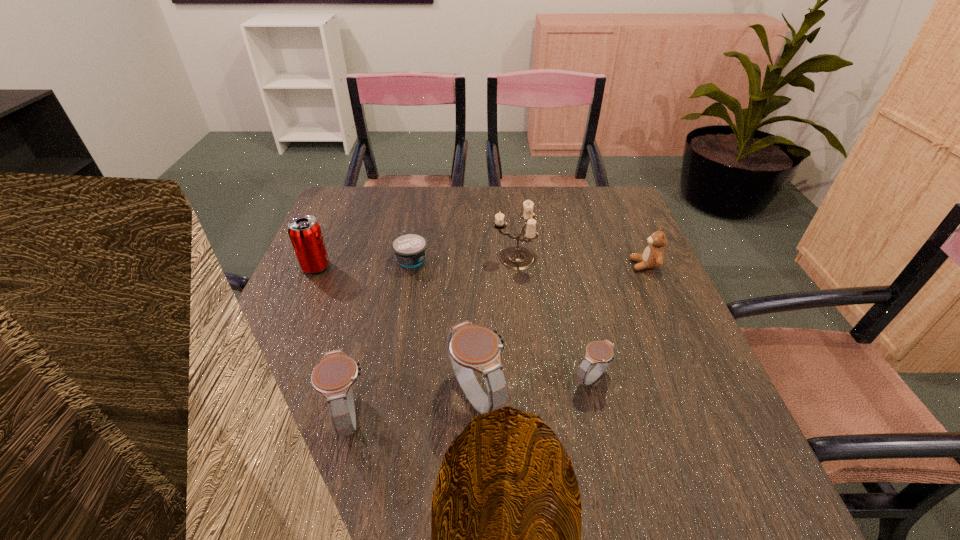
Image resolution: width=960 pixels, height=540 pixels. Identify the location of free space between the candle holder and the second tallest watch. (432, 337).

Where is `empty location between the second watch from right to left and the rightmost object`? This screenshot has height=540, width=960. empty location between the second watch from right to left and the rightmost object is located at coordinates (561, 331).

This screenshot has width=960, height=540. In order to click on free area in between the yogurt and the second shortest watch in this screenshot , I will do `click(381, 338)`.

The height and width of the screenshot is (540, 960). I want to click on free space between the second watch from right to left and the rightmost object, so click(561, 331).

Choose which object is the third nearest neighbor to the shortest object. Please provide its 2D coordinates. Your answer should be formatted as a tuple, i.e. [(x, y)], where the tuple contains the x and y coordinates of a point satisfying the conditions above.

[(470, 347)]

Select which object is the closest to the leftmost object. Please provide its 2D coordinates. Your answer should be formatted as a tuple, i.e. [(x, y)], where the tuple contains the x and y coordinates of a point satisfying the conditions above.

[(409, 248)]

In order to click on watch that is the closest one to the second watch from left to right in this screenshot , I will do `click(601, 353)`.

Identify the location of watch that is the second closest one to the candle holder. (601, 353).

Find the location of a particular element. vacant space that satisfies the following two spatial constraints: 1. on the back side of the second shortest watch; 2. on the left side of the candle holder is located at coordinates (390, 258).